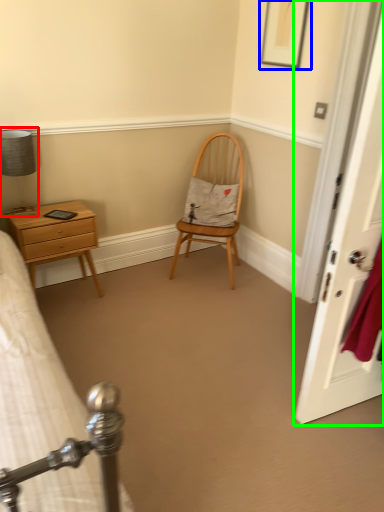
Question: Considering the real-world distances, which object is closest to bedside lamp (highlighted by a red box)? picture frame (highlighted by a blue box) or door (highlighted by a green box).

Choices:
 (A) picture frame
 (B) door

Answer: (A)